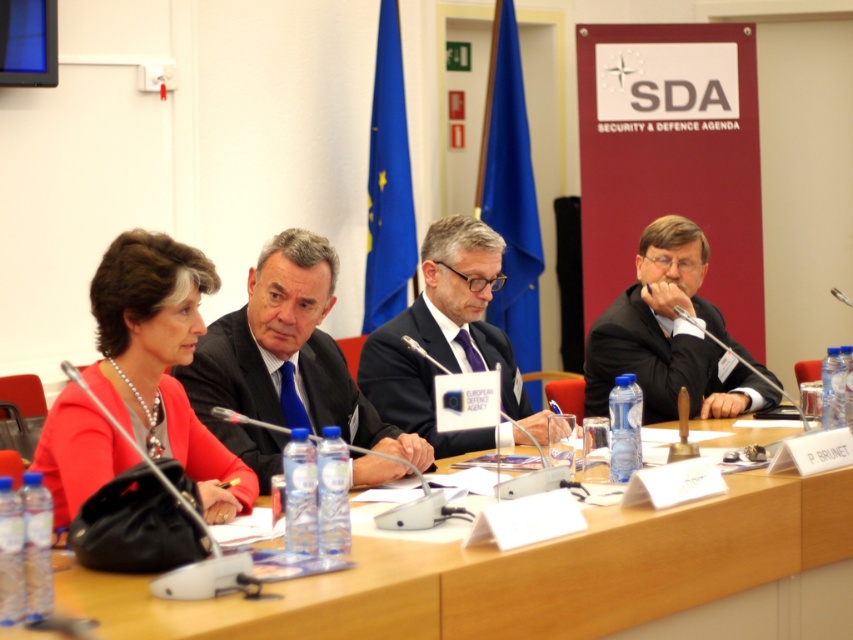
Is point (587, 612) less distant than point (648, 348)?

Yes, point (587, 612) is closer to viewer.

Does wooden table at center come in front of black suit at right?

Yes, it is in front of black suit at right.

Which is in front, point (657, 588) or point (654, 406)?

Point (657, 588) is more forward.

At what (x,y) coordinates should I click in order to perform the action: click on wooden table at center. Please return your answer as a coordinate pair (x, y). Looking at the image, I should click on (543, 577).

Which is above, wooden table at center or dark blue suit at center?

dark blue suit at center is above.

Can you confirm if wooden table at center is smaller than dark blue suit at center?

Incorrect, wooden table at center is not smaller in size than dark blue suit at center.

Is point (476, 621) more distant than point (381, 467)?

No, it is not.

Where is `wooden table at center`? wooden table at center is located at coordinates (543, 577).

Between matte red blouse at center and dark blue suit at center, which one appears on the left side from the viewer's perspective?

matte red blouse at center

Does matte red blouse at center have a smaller size compared to dark blue suit at center?

Yes.

Locate an element on the screen. Image resolution: width=853 pixels, height=640 pixels. matte red blouse at center is located at coordinates (160, 358).

Where is `matte red blouse at center`? This screenshot has width=853, height=640. matte red blouse at center is located at coordinates (160, 358).